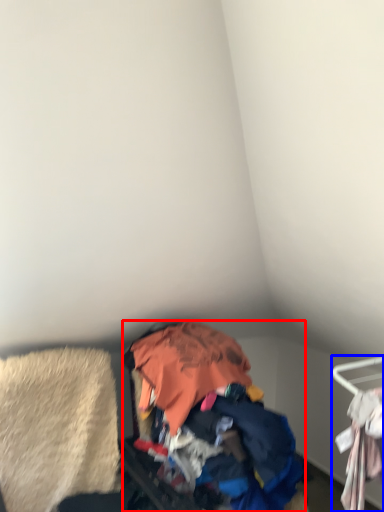
Question: Which of the following is the farthest to the observer, garbage (highlighted by a red box) or furniture (highlighted by a blue box)?

Choices:
 (A) garbage
 (B) furniture

Answer: (A)